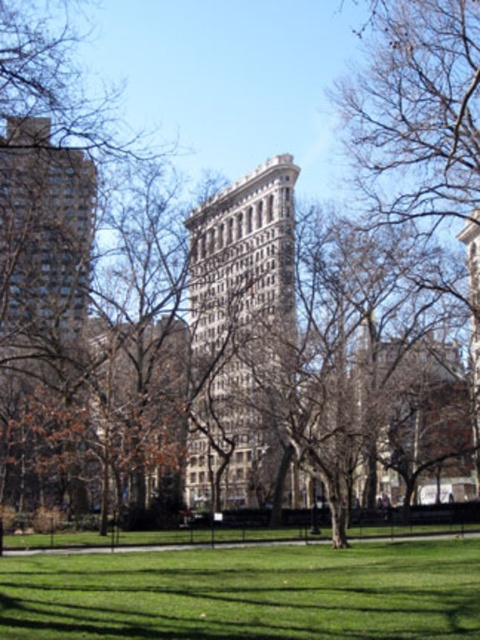
Which is below, brown leafless tree at center or white stone tower at center?

white stone tower at center

Can you confirm if brown leafless tree at center is shorter than white stone tower at center?

No.

Between point (384, 10) and point (476, 352), which one is positioned in front?

Point (384, 10) is more forward.

In order to click on brown leafless tree at center in this screenshot , I will do `click(421, 131)`.

Does point (26, 134) lie behind point (479, 440)?

No, it is in front of (479, 440).

Can you confirm if matte glass building at left is positioned to the left of white stone tower at center?

Indeed, matte glass building at left is positioned on the left side of white stone tower at center.

At what (x,y) coordinates should I click in order to perform the action: click on matte glass building at left. Please return your answer as a coordinate pair (x, y). This screenshot has height=640, width=480. Looking at the image, I should click on (43, 244).

Which is more to the right, brown leafless tree at left or white stone building at center?

white stone building at center is more to the right.

Consider the image. Does brown leafless tree at left have a greater height compared to white stone building at center?

No, brown leafless tree at left is not taller than white stone building at center.

Between point (82, 177) and point (204, 476), which one is positioned in front?

Positioned in front is point (82, 177).

The height and width of the screenshot is (640, 480). What are the coordinates of `brown leafless tree at left` in the screenshot? It's located at (46, 186).